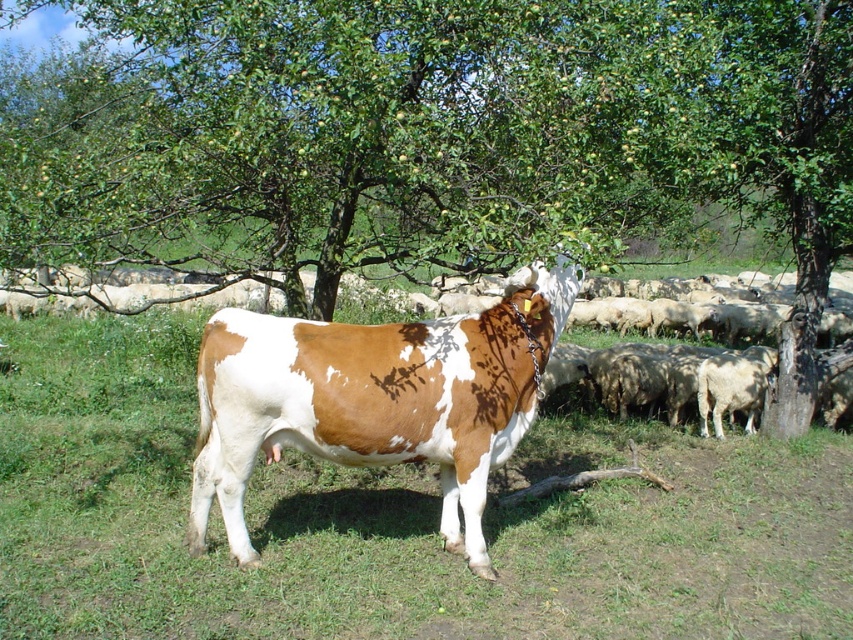
Question: Is green leafy tree at center above brown and white textured cow at center?

Choices:
 (A) no
 (B) yes

Answer: (B)

Question: Can you confirm if green leafy tree at center is positioned below brown and white textured cow at center?

Choices:
 (A) yes
 (B) no

Answer: (B)

Question: Observing the image, what is the correct spatial positioning of green leafy tree at center in reference to brown and white textured cow at center?

Choices:
 (A) above
 (B) below

Answer: (A)

Question: Which point is closer to the camera?

Choices:
 (A) green leafy tree at center
 (B) brown and white textured cow at center

Answer: (B)